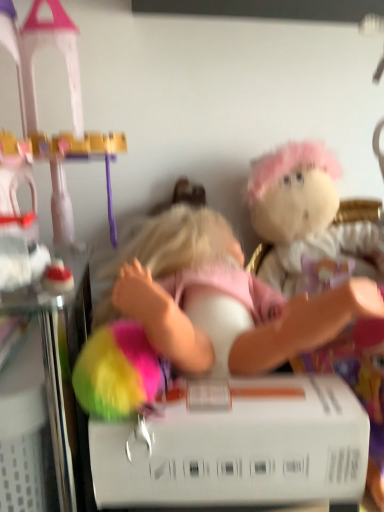
Question: Can you confirm if pink fabric doll at center is shorter than fluffy white plush at upper right?

Choices:
 (A) yes
 (B) no

Answer: (A)

Question: Is pink fabric doll at center outside fluffy white plush at upper right?

Choices:
 (A) no
 (B) yes

Answer: (B)

Question: Does pink fabric doll at center have a greater width compared to fluffy white plush at upper right?

Choices:
 (A) yes
 (B) no

Answer: (A)

Question: From the image's perspective, would you say pink fabric doll at center is shown under fluffy white plush at upper right?

Choices:
 (A) no
 (B) yes

Answer: (B)

Question: Considering the relative sizes of pink fabric doll at center and fluffy white plush at upper right in the image provided, is pink fabric doll at center smaller than fluffy white plush at upper right?

Choices:
 (A) no
 (B) yes

Answer: (B)

Question: Choose the correct answer: Is pink fabric doll at center inside white matte box at center or outside it?

Choices:
 (A) outside
 (B) inside

Answer: (A)

Question: Is pink fabric doll at center wider or thinner than white matte box at center?

Choices:
 (A) thin
 (B) wide

Answer: (B)

Question: Does point (198, 368) appear closer or farther from the camera than point (196, 493)?

Choices:
 (A) closer
 (B) farther

Answer: (B)

Question: From a real-world perspective, is pink fabric doll at center physically located above or below white matte box at center?

Choices:
 (A) below
 (B) above

Answer: (B)

Question: Is white matte box at center in front of or behind pink fabric doll at center in the image?

Choices:
 (A) behind
 (B) front

Answer: (B)

Question: Is point (299, 423) positioned closer to the camera than point (294, 351)?

Choices:
 (A) closer
 (B) farther

Answer: (A)

Question: From a real-world perspective, is white matte box at center above or below pink fabric doll at center?

Choices:
 (A) above
 (B) below

Answer: (B)

Question: Is white matte box at center taller or shorter than pink fabric doll at center?

Choices:
 (A) short
 (B) tall

Answer: (A)

Question: Is pink fabric doll at center wider or thinner than fluffy white plush at upper right?

Choices:
 (A) thin
 (B) wide

Answer: (B)

Question: Considering the positions of point (374, 302) and point (291, 177), is point (374, 302) closer or farther from the camera than point (291, 177)?

Choices:
 (A) closer
 (B) farther

Answer: (A)